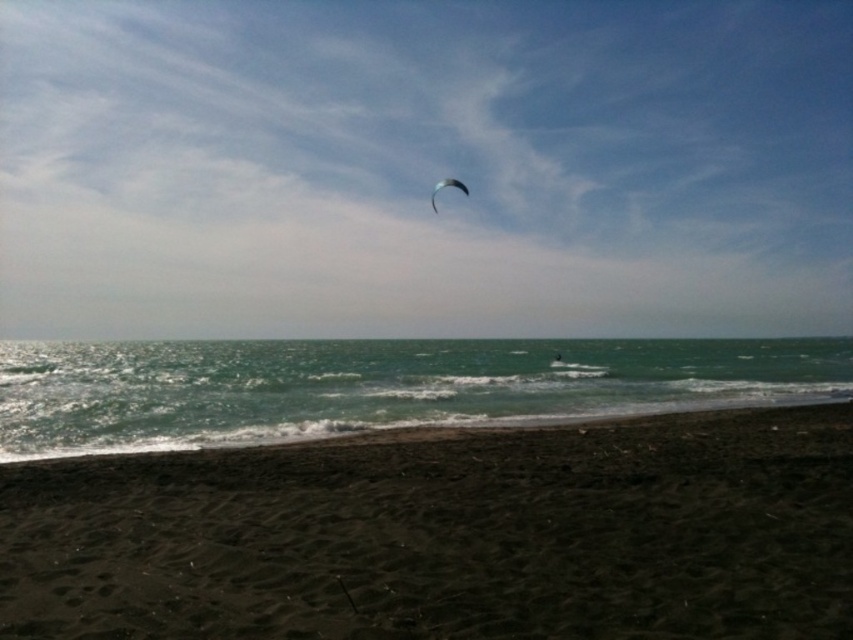
Question: Which of the following is the closest to the observer?

Choices:
 (A) (331, 561)
 (B) (791, 42)

Answer: (A)

Question: Estimate the real-world distances between objects in this image. Which object is farther from the greenish-blue water at lower center?

Choices:
 (A) transparent blue kite at upper center
 (B) dark sand at lower center

Answer: (A)

Question: Estimate the real-world distances between objects in this image. Which object is closer to the greenish-blue water at lower center?

Choices:
 (A) transparent blue kite at upper center
 (B) matte black parachute at upper center

Answer: (B)

Question: Does dark sand at lower center have a larger size compared to greenish-blue water at lower center?

Choices:
 (A) no
 (B) yes

Answer: (A)

Question: Is transparent blue kite at upper center further to camera compared to dark sand at lower center?

Choices:
 (A) no
 (B) yes

Answer: (B)

Question: Considering the relative positions of dark sand at lower center and matte black parachute at upper center in the image provided, where is dark sand at lower center located with respect to matte black parachute at upper center?

Choices:
 (A) above
 (B) below

Answer: (B)